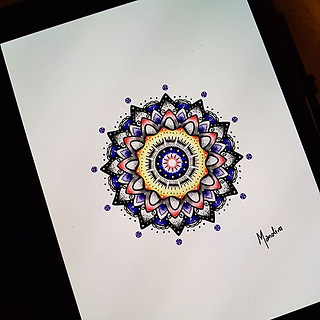
Where is `wall`? The height and width of the screenshot is (320, 320). wall is located at coordinates (307, 28).